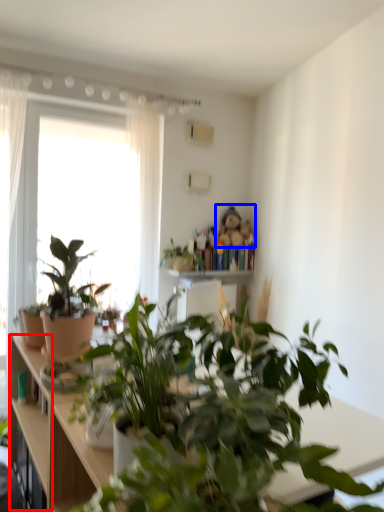
Question: Which of the following is the farthest to the observer, cabinet (highlighted by a red box) or toy (highlighted by a blue box)?

Choices:
 (A) cabinet
 (B) toy

Answer: (B)